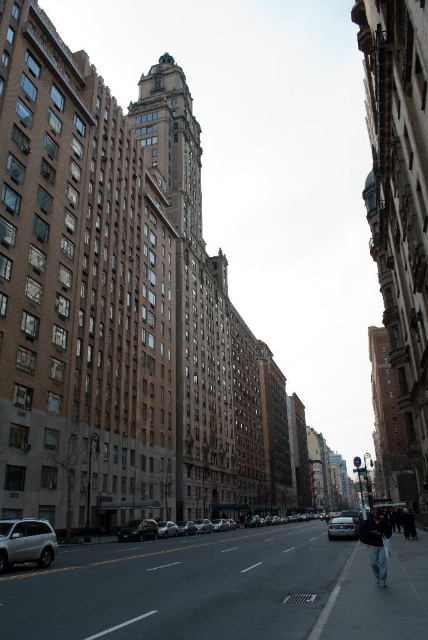
Question: Which object appears closest to the camera in this image?

Choices:
 (A) dark blue jeans at lower right
 (B) shiny silver sedan at center

Answer: (A)

Question: Does shiny silver car at center appear over silver metallic car at center?

Choices:
 (A) no
 (B) yes

Answer: (A)

Question: Can you confirm if silver metallic car at center is positioned to the left of shiny silver sedan at center?

Choices:
 (A) no
 (B) yes

Answer: (A)

Question: Which point is farther to the camera?

Choices:
 (A) silver metallic car at center
 (B) silver metallic suv at lower left

Answer: (A)

Question: Is silver metallic suv at lower left closer to the viewer compared to silver metallic car at center?

Choices:
 (A) yes
 (B) no

Answer: (A)

Question: Which is nearer to the shiny silver sedan at center?

Choices:
 (A) shiny silver car at center
 (B) silver metallic suv at lower left
 (C) dark blue jeans at lower right

Answer: (A)